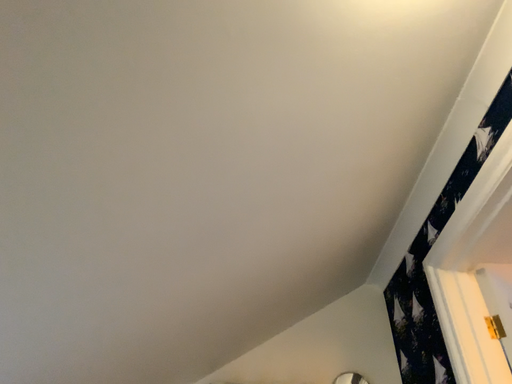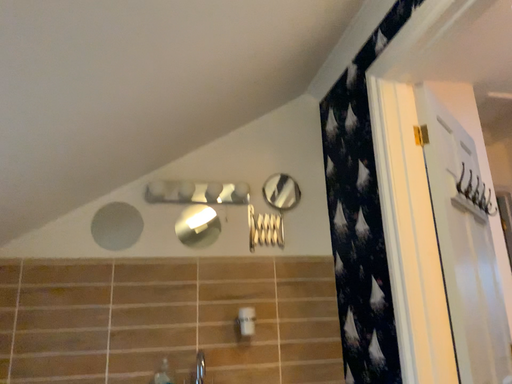
Question: Which way did the camera rotate in the video?

Choices:
 (A) rotated right
 (B) rotated left

Answer: (A)